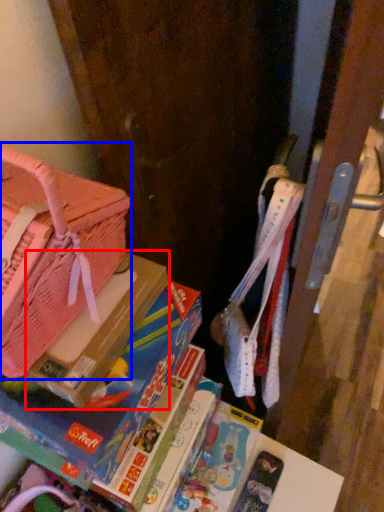
Question: Which object appears farthest to the camera in this image, paperback book (highlighted by a red box) or handbag (highlighted by a blue box)?

Choices:
 (A) paperback book
 (B) handbag

Answer: (A)